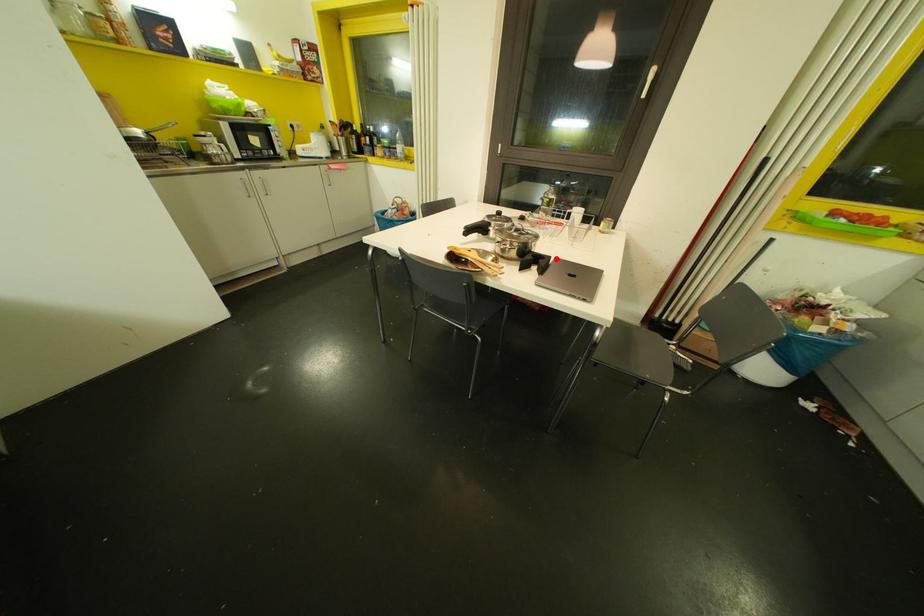
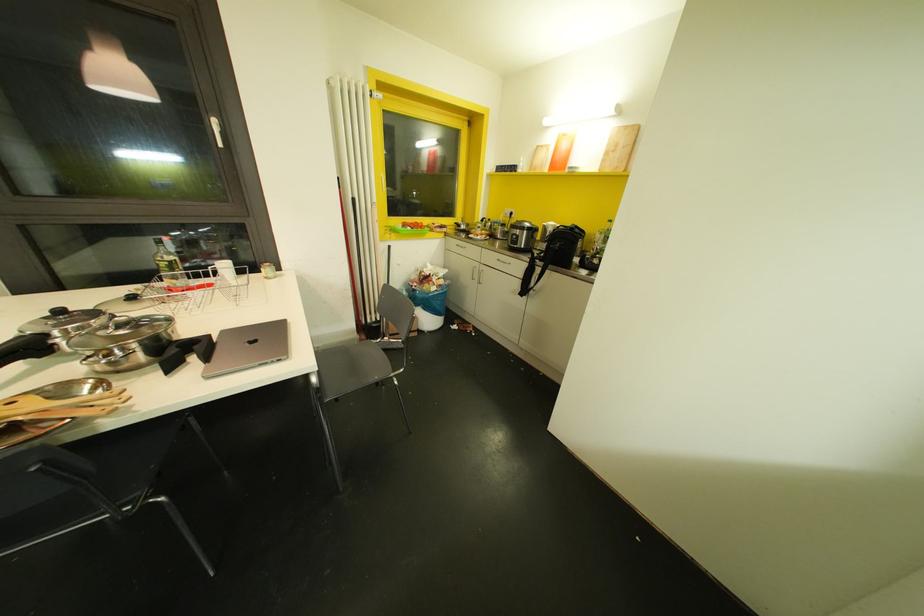
In the second image, find the point that corresponds to the highlighted location in the first image.

(223, 331)